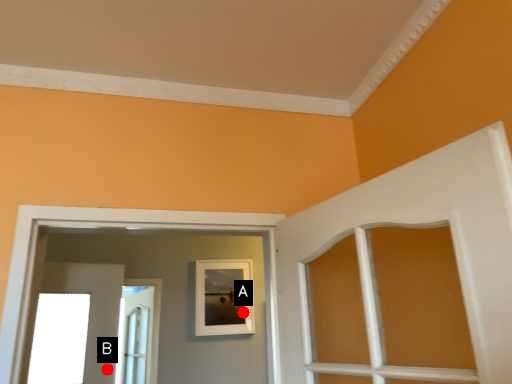
Question: Two points are circled on the image, labeled by A and B beside each circle. Which point appears closest to the camera in this image?

Choices:
 (A) A is closer
 (B) B is closer

Answer: (B)